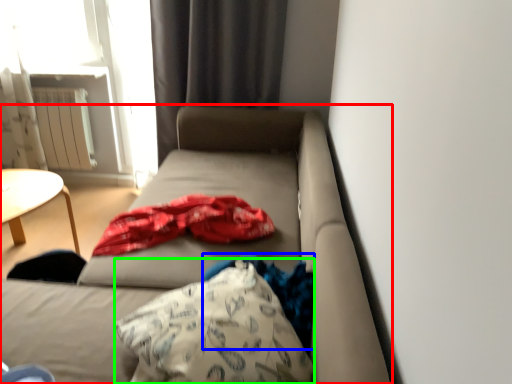
Question: Based on their relative distances, which object is nearer to studio couch (highlighted by a red box)? Choose from clothing (highlighted by a blue box) and throw pillow (highlighted by a green box).

Choices:
 (A) clothing
 (B) throw pillow

Answer: (B)